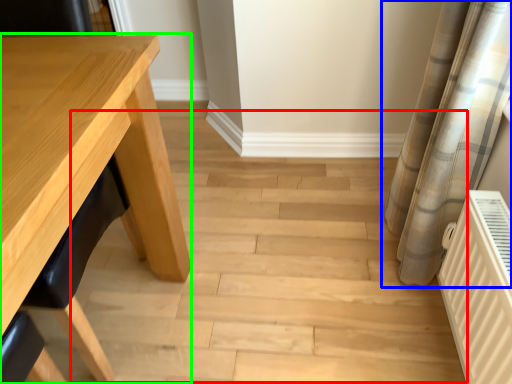
Question: Which is farther away from stair (highlighted by a red box)? curtain (highlighted by a blue box) or table (highlighted by a green box)?

Choices:
 (A) curtain
 (B) table

Answer: (B)